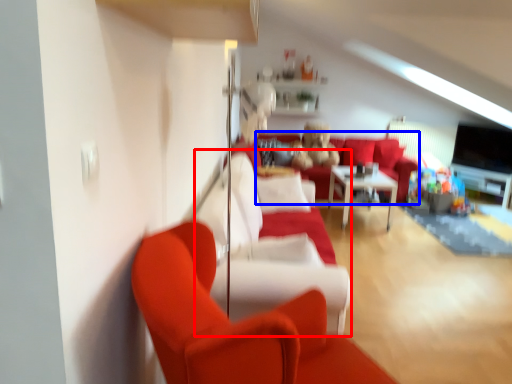
Question: Which of the following is the farthest to the observer, couch (highlighted by a red box) or couch (highlighted by a blue box)?

Choices:
 (A) couch
 (B) couch

Answer: (B)